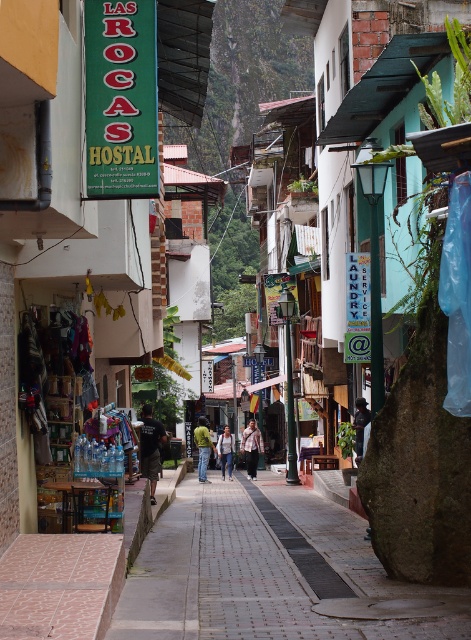
Based on the photo, you are standing at the entrance of Las Rocas Hostal and want to find the plaid shirt at center. According to the coordinates provided, in which direction should you look to locate it?

The plaid shirt at center is located at coordinates point (251,448), which means it is positioned to the right and slightly above the center of the image, so you should look towards the upper right direction from the entrance.

Based on the photo, you are standing on the street and see the dark brown leather jacket at center. If you were to walk directly towards it from your current position, which direction should you move relative to your current facing? Please provide your answer based on the coordinates provided in the Objects Description.

The dark brown leather jacket at center is located at coordinates point (359, 426). Since the coordinate system is not specified, the exact direction cannot be determined. However, if assuming standard image coordinates where the origin is at the bottom left corner, moving towards the jacket would involve moving to the upper right direction from your current position.

You are standing on the street in front of Las Rocas Hostal and want to pick up the plaid shirt at center. Is it within arm reach?

The plaid shirt at center is 132.95 feet from viewer, so it is not within arm reach.